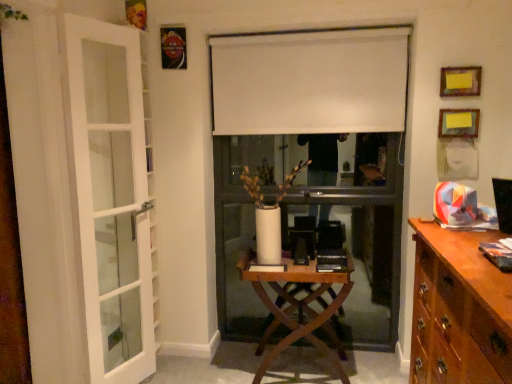
You are a GUI agent. You are given a task and a screenshot of the screen. Output one action in this format:
    pyautogui.click(x=<x>, y=<y>)
    Task: Click on the free area below wooden at center (from a real-world perspective)
    
    Given the screenshot: What is the action you would take?
    pyautogui.click(x=306, y=366)